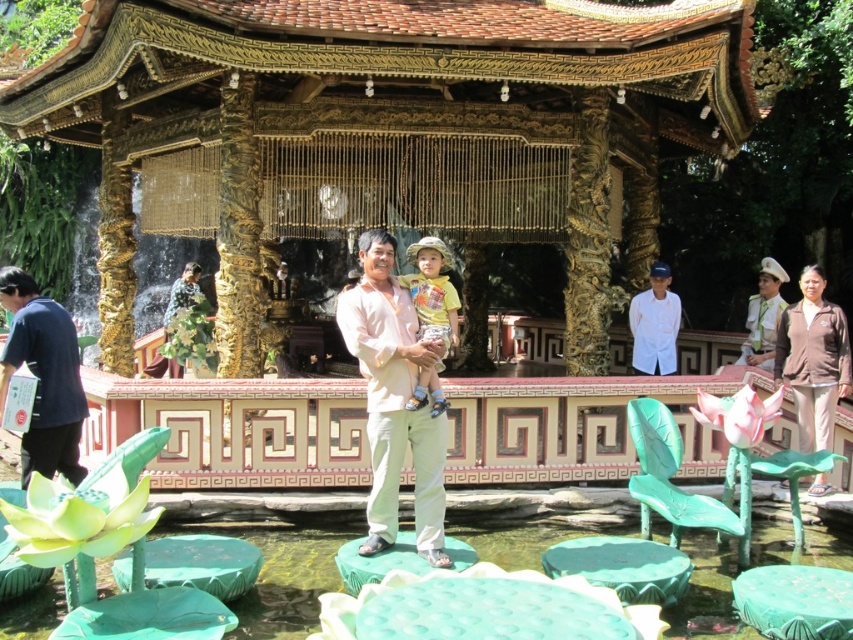
Question: Does green plastic lotus at center have a lesser width compared to brown matte jacket at lower right?

Choices:
 (A) no
 (B) yes

Answer: (A)

Question: Does green matte lotus leaf at lower center come behind green plastic lotus leaf at lower right?

Choices:
 (A) yes
 (B) no

Answer: (B)

Question: Is green plastic lotus at center bigger than dark blue shirt at left?

Choices:
 (A) no
 (B) yes

Answer: (A)

Question: Which point is closer to the camera?

Choices:
 (A) (376, 429)
 (B) (643, 412)
 (C) (793, 396)
 (D) (665, 120)

Answer: (A)

Question: Which of the following is the farthest from the observer?

Choices:
 (A) dark blue shirt at left
 (B) white cotton shirt at upper right

Answer: (B)

Question: Which point appears closest to the camera in this image?

Choices:
 (A) (412, 429)
 (B) (654, 442)
 (C) (839, 362)

Answer: (A)